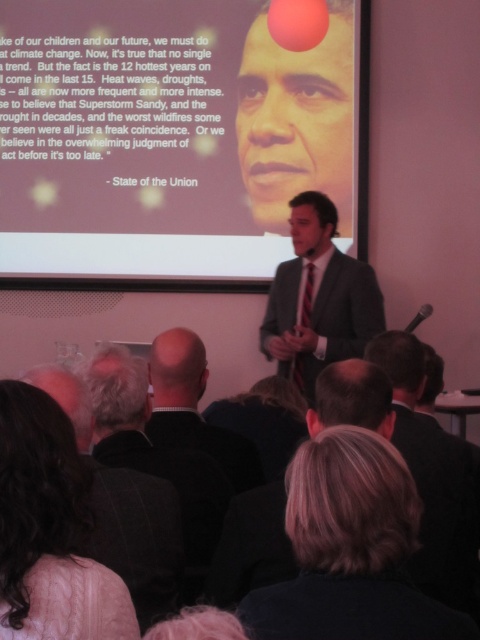
Question: Which point is farther from the camera taking this photo?

Choices:
 (A) (107, 20)
 (B) (420, 429)

Answer: (A)

Question: Which object is closer to the camera taking this photo?

Choices:
 (A) white knitted sweater at lower left
 (B) white matte projection screen at upper center

Answer: (A)

Question: Where is white matte projection screen at upper center located in relation to gray suit at center in the image?

Choices:
 (A) right
 (B) left

Answer: (B)

Question: In this image, where is white matte projection screen at upper center located relative to gray suit at center?

Choices:
 (A) above
 (B) below

Answer: (A)

Question: Does white matte projection screen at upper center have a lesser width compared to dark suit at center?

Choices:
 (A) no
 (B) yes

Answer: (A)

Question: Which object appears farthest from the camera in this image?

Choices:
 (A) dark suit at center
 (B) white knitted sweater at lower left

Answer: (A)